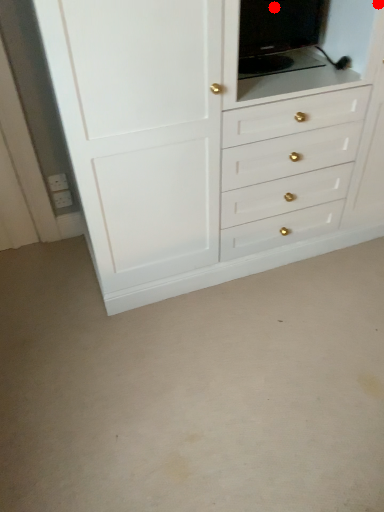
Question: Two points are circled on the image, labeled by A and B beside each circle. Which point is closer to the camera?

Choices:
 (A) A is closer
 (B) B is closer

Answer: (A)